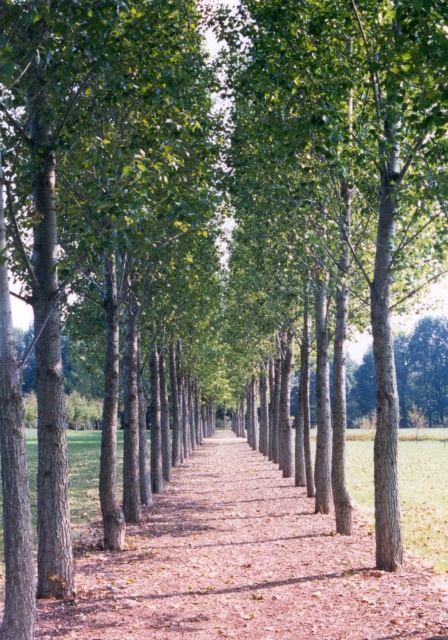
Can you confirm if smooth bark tree at center is positioned to the left of brown bark path at center?

Incorrect, smooth bark tree at center is not on the left side of brown bark path at center.

Describe the element at coordinates (348, 157) in the screenshot. I see `smooth bark tree at center` at that location.

Describe the element at coordinates (348, 157) in the screenshot. I see `smooth bark tree at center` at that location.

You are a GUI agent. You are given a task and a screenshot of the screen. Output one action in this format:
    pyautogui.click(x=<x>, y=<y>)
    Task: Click on the smooth bark tree at center
    The image size is (448, 640).
    Given the screenshot: What is the action you would take?
    pyautogui.click(x=348, y=157)